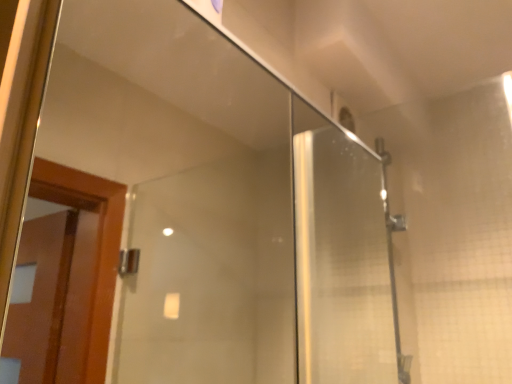
You are a GUI agent. You are given a task and a screenshot of the screen. Output one action in this format:
    pyautogui.click(x=<x>, y=<y>)
    Task: Click on the matte wood door at left
    The height and width of the screenshot is (384, 512).
    Given the screenshot: What is the action you would take?
    pyautogui.click(x=155, y=208)

What do you see at coordinates (155, 208) in the screenshot?
I see `matte wood door at left` at bounding box center [155, 208].

The height and width of the screenshot is (384, 512). I want to click on matte wood door at left, so click(x=155, y=208).